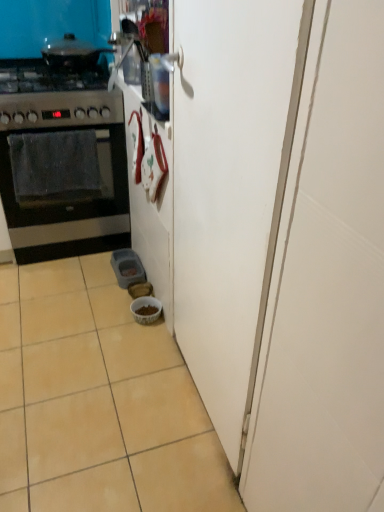
Locate an element on the screen. The image size is (384, 512). black matte oven at left is located at coordinates (64, 175).

What is the approximate width of shiny black pot at upper left?

The width of shiny black pot at upper left is 19.96 inches.

What do you see at coordinates (61, 162) in the screenshot? I see `black matte oven at left` at bounding box center [61, 162].

What is the approximate width of white matte door at center?

white matte door at center is 3.39 inches wide.

In order to click on stainless steel gas stove at left in this screenshot , I will do `click(54, 97)`.

Find the location of a particular element. Image resolution: width=384 pixels, height=512 pixels. black matte oven at left is located at coordinates (64, 175).

From a real-world perspective, which is physically above, white glossy bowl at lower center or white matte door at center?

white matte door at center.

Considering the positions of objects white glossy bowl at lower center and white matte door at center in the image provided, who is more to the right, white glossy bowl at lower center or white matte door at center?

Positioned to the right is white matte door at center.

Based on the photo, is white glossy bowl at lower center taller or shorter than white matte door at center?

Clearly, white glossy bowl at lower center is shorter compared to white matte door at center.

Is white glossy bowl at lower center closer to the viewer compared to white matte door at center?

No, white glossy bowl at lower center is further to the viewer.

Which is more to the right, stainless steel gas stove at left or white matte door at center?

white matte door at center.

Can you confirm if stainless steel gas stove at left is thinner than white matte door at center?

No.

From a real-world perspective, is stainless steel gas stove at left under white matte door at center?

No, from a real-world perspective, stainless steel gas stove at left is not below white matte door at center.

Which is behind, stainless steel gas stove at left or white matte door at center?

Positioned behind is stainless steel gas stove at left.

In the image, is white glossy bowl at lower center positioned in front of or behind black matte oven at left?

Visually, white glossy bowl at lower center is located behind black matte oven at left.

From a real-world perspective, does white glossy bowl at lower center stand above black matte oven at left?

No.

Can you confirm if white glossy bowl at lower center is wider than black matte oven at left?

No.

Who is taller, white glossy bowl at lower center or black matte oven at left?

Standing taller between the two is black matte oven at left.

Are shiny black pot at upper left and stainless steel gas stove at left located far from each other?

No, shiny black pot at upper left is not far away from stainless steel gas stove at left.

Considering the sizes of shiny black pot at upper left and stainless steel gas stove at left in the image, is shiny black pot at upper left taller or shorter than stainless steel gas stove at left?

Clearly, shiny black pot at upper left is shorter compared to stainless steel gas stove at left.

Which object is thinner, shiny black pot at upper left or stainless steel gas stove at left?

shiny black pot at upper left is thinner.

Locate an element on the screen. This screenshot has width=384, height=512. open on the right of stainless steel gas stove at left is located at coordinates (72, 53).

Considering the relative sizes of white matte door at center and white glossy bowl at lower center in the image provided, is white matte door at center thinner than white glossy bowl at lower center?

Yes, white matte door at center is thinner than white glossy bowl at lower center.

Does point (187, 267) come farther from viewer compared to point (143, 305)?

No, it is not.

Is white matte door at center looking in the opposite direction of white glossy bowl at lower center?

That's not correct — white matte door at center is not looking away from white glossy bowl at lower center.

Can you confirm if white matte door at center is taller than white glossy bowl at lower center?

Indeed, white matte door at center has a greater height compared to white glossy bowl at lower center.

Who is taller, black matte oven at left or shiny black pot at upper left?

black matte oven at left is taller.

Does point (114, 152) come farther from viewer compared to point (44, 48)?

No, it is in front of (44, 48).

In the scene shown: Does black matte oven at left have a larger size compared to shiny black pot at upper left?

No, black matte oven at left is not bigger than shiny black pot at upper left.

From the image's perspective, which object appears higher, shiny black pot at upper left or white matte door at center?

shiny black pot at upper left.

Locate an element on the screen. open above the white matte door at center (from a real-world perspective) is located at coordinates click(72, 53).

Measure the distance between shiny black pot at upper left and white matte door at center.

shiny black pot at upper left and white matte door at center are 4.61 feet apart from each other.

Is shiny black pot at upper left looking in the opposite direction of white matte door at center?

No, shiny black pot at upper left's orientation is not away from white matte door at center.

This screenshot has width=384, height=512. Find the location of `bowl located on the left of white matte door at center`. bowl located on the left of white matte door at center is located at coordinates (146, 309).

Where is `gas stove located behind the white matte door at center`? Image resolution: width=384 pixels, height=512 pixels. gas stove located behind the white matte door at center is located at coordinates (54, 97).

Based on their spatial positions, is black matte oven at left or beige ceramic tile at lower left further from shiny black pot at upper left?

beige ceramic tile at lower left is positioned further to the anchor shiny black pot at upper left.

Based on their spatial positions, is beige ceramic tile at lower left or black matte oven at left further from black matte oven at left?

beige ceramic tile at lower left is positioned further to the anchor black matte oven at left.

Considering their positions, is shiny black pot at upper left positioned closer to stainless steel gas stove at left than black matte oven at left?

Based on the image, black matte oven at left appears to be nearer to stainless steel gas stove at left.

Estimate the real-world distances between objects in this image. Which object is closer to white glossy bowl at lower center, white matte door at center or black matte oven at left?

The object closer to white glossy bowl at lower center is black matte oven at left.

From the image, which object appears to be nearer to shiny black pot at upper left, beige ceramic tile at lower left or white glossy bowl at lower center?

white glossy bowl at lower center is closer to shiny black pot at upper left.

Which object lies nearer to the anchor point white glossy bowl at lower center, beige ceramic tile at lower left or black matte oven at left?

Based on the image, beige ceramic tile at lower left appears to be nearer to white glossy bowl at lower center.

When comparing their distances from white glossy bowl at lower center, does shiny black pot at upper left or white matte door at center seem further?

The object further to white glossy bowl at lower center is shiny black pot at upper left.

Which object lies nearer to the anchor point white matte door at center, stainless steel gas stove at left or shiny black pot at upper left?

stainless steel gas stove at left lies closer to white matte door at center than the other object.

Locate an element on the screen. ceramic tile positioned between white matte door at center and black matte oven at left from near to far is located at coordinates (98, 401).

Where is `gas stove between shiny black pot at upper left and beige ceramic tile at lower left in the vertical direction`? gas stove between shiny black pot at upper left and beige ceramic tile at lower left in the vertical direction is located at coordinates (54, 97).

The width and height of the screenshot is (384, 512). What are the coordinates of `kitchen appliance between stainless steel gas stove at left and beige ceramic tile at lower left in the up-down direction` in the screenshot? It's located at (61, 162).

The width and height of the screenshot is (384, 512). I want to click on gas stove between shiny black pot at upper left and black matte oven at left vertically, so click(x=54, y=97).